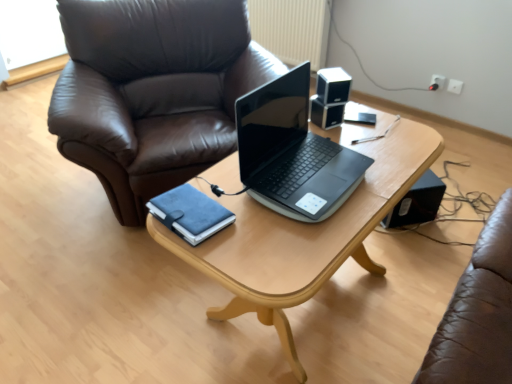
This screenshot has height=384, width=512. In order to click on vacant space that's between suede blue notebook at center and sleek black laptop at center in this screenshot , I will do `click(243, 211)`.